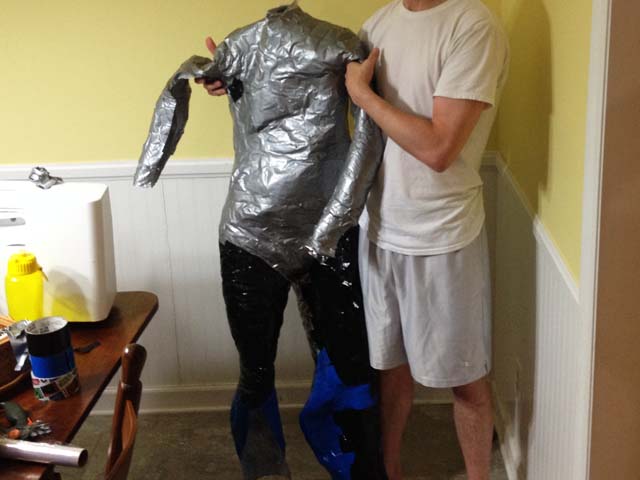
Where is `mannequin`? This screenshot has width=640, height=480. mannequin is located at coordinates (285, 193).